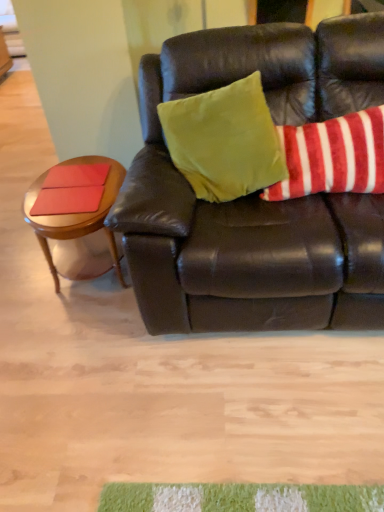
You are a GUI agent. You are given a task and a screenshot of the screen. Output one action in this format:
    pyautogui.click(x=<x>, y=<y>)
    Task: Click on the free space in front of woodenwoodentable at left
    
    Given the screenshot: What is the action you would take?
    pyautogui.click(x=81, y=345)